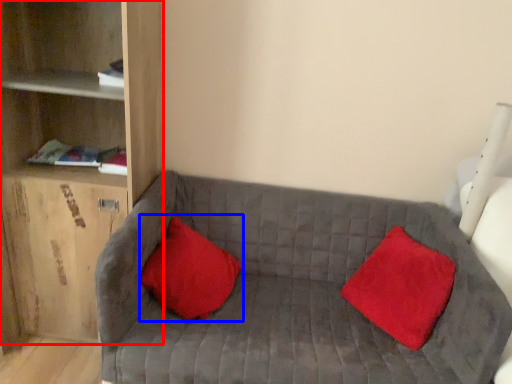
Question: Which point is further to the camera, shelf (highlighted by a red box) or pillow (highlighted by a blue box)?

Choices:
 (A) shelf
 (B) pillow

Answer: (B)